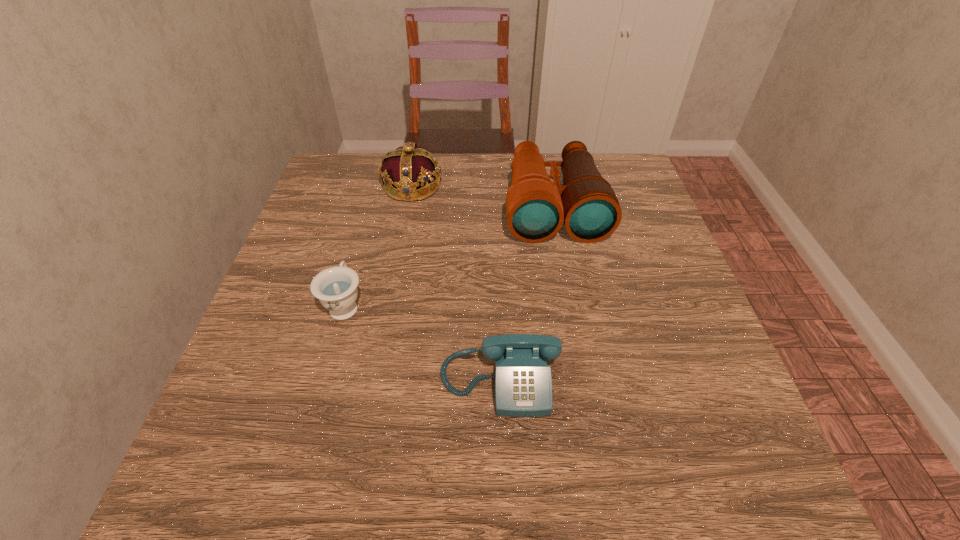
Locate an element on the screen. This screenshot has width=960, height=540. blank space at the far right corner of the desktop is located at coordinates (613, 172).

Locate an element on the screen. vacant space at the near right corner of the desktop is located at coordinates (720, 491).

Where is `vacant space that is in between the teacup and the telephone`? vacant space that is in between the teacup and the telephone is located at coordinates (422, 342).

Identify the location of vacant area that lies between the binoculars and the telephone. This screenshot has height=540, width=960. tap(527, 293).

You are a GUI agent. You are given a task and a screenshot of the screen. Output one action in this format:
    pyautogui.click(x=<x>, y=<y>)
    Task: Click on the blank region between the nearest object and the binoculars
    The image size is (960, 540).
    Given the screenshot: What is the action you would take?
    pyautogui.click(x=527, y=293)

I want to click on free point between the nearest object and the third farthest object, so click(422, 342).

Where is `free space between the crown and the telephone`? Image resolution: width=960 pixels, height=540 pixels. free space between the crown and the telephone is located at coordinates (456, 284).

Find the location of a particular element. The width and height of the screenshot is (960, 540). free space between the crown and the telephone is located at coordinates (456, 284).

Where is `free space between the crown and the second nearest object`? The image size is (960, 540). free space between the crown and the second nearest object is located at coordinates point(378,246).

Identify the location of unoccupied position between the telephone and the binoculars. The width and height of the screenshot is (960, 540). (527, 293).